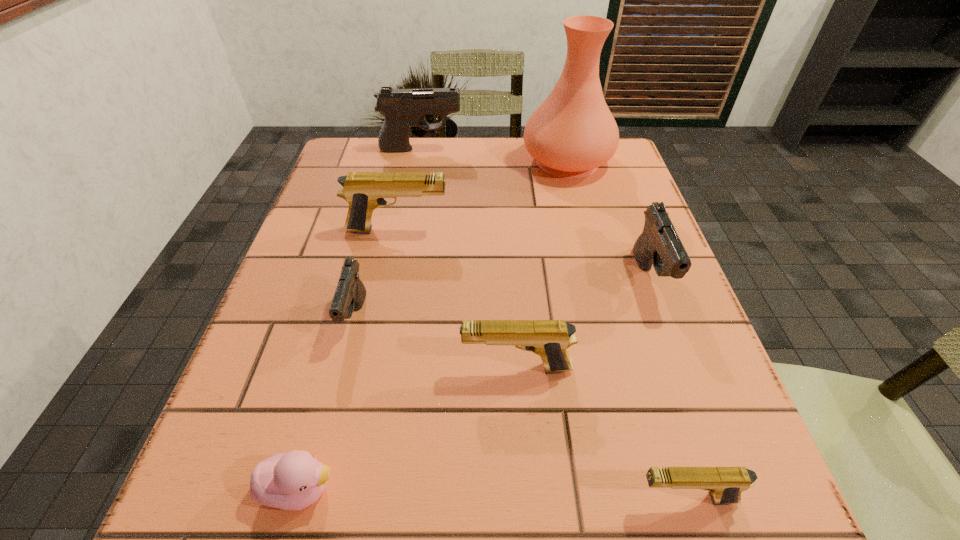
Locate an element on the screen. This screenshot has width=960, height=540. the rightmost tan pistol is located at coordinates (725, 484).

At what (x,y) coordinates should I click in order to perform the action: click on the smallest tan pistol. Please return your answer as a coordinate pair (x, y). This screenshot has width=960, height=540. Looking at the image, I should click on (725, 484).

Find the location of a particular element. free spot located 0.400m on the front of the vase is located at coordinates (606, 314).

I want to click on free region located 0.400m at the barrel of the farthest pistol, so click(609, 149).

Find the location of `free space located 0.290m at the barrel of the leftmost tan pistol`. free space located 0.290m at the barrel of the leftmost tan pistol is located at coordinates (581, 230).

Locate an element on the screen. This screenshot has width=960, height=540. free space located 0.290m at the barrel of the second biggest black pistol is located at coordinates (725, 478).

In order to click on vacant area situated at the barrel of the second tan pistol from right to left in this screenshot , I will do `click(327, 368)`.

At what (x,y) coordinates should I click in order to perform the action: click on vacant space located 0.120m at the barrel of the second tan pistol from right to left. Please return your answer as a coordinate pair (x, y). Looking at the image, I should click on (389, 368).

Where is `free space located 0.170m at the barrel of the second tan pistol from right to left`? free space located 0.170m at the barrel of the second tan pistol from right to left is located at coordinates (358, 368).

This screenshot has height=540, width=960. In order to click on vacant area located 0.140m at the barrel of the smallest black pistol in this screenshot , I will do `click(328, 426)`.